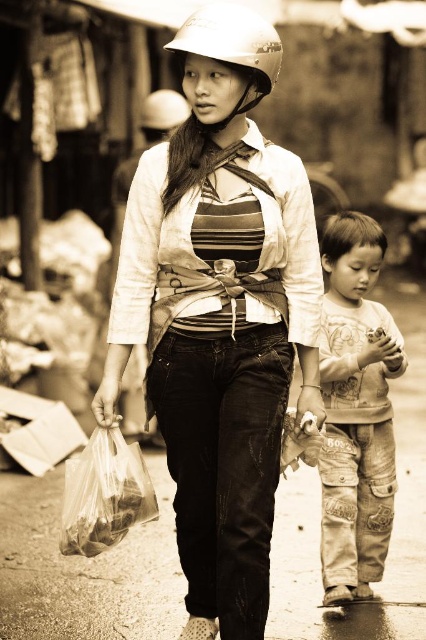
Question: Which point is closer to the camera?

Choices:
 (A) (186, 76)
 (B) (123, 445)

Answer: (B)

Question: Which object appears farthest from the camera in this image?

Choices:
 (A) translucent plastic bag at lower left
 (B) printed cotton shirt at lower right

Answer: (B)

Question: Estimate the real-world distances between objects in this image. Which object is closer to the matte white helmet at upper center?

Choices:
 (A) printed cotton shirt at lower right
 (B) matte black helmet at center

Answer: (B)

Question: Is matte black helmet at center thinner than printed cotton shirt at lower right?

Choices:
 (A) no
 (B) yes

Answer: (A)

Question: Can you confirm if matte black helmet at center is positioned to the left of printed cotton shirt at lower right?

Choices:
 (A) yes
 (B) no

Answer: (A)

Question: Can you confirm if printed cotton shirt at lower right is bigger than matte white helmet at upper center?

Choices:
 (A) yes
 (B) no

Answer: (A)